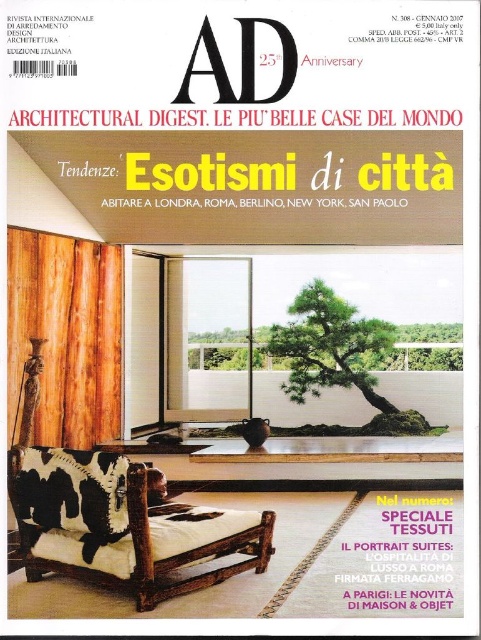
Is green textured bonsai at center thinner than green leafy tree at center?

No.

Who is shorter, green textured bonsai at center or green leafy tree at center?

Standing shorter between the two is green leafy tree at center.

Where is `green textured bonsai at center`? green textured bonsai at center is located at coordinates (330, 346).

The height and width of the screenshot is (640, 481). Identify the location of green textured bonsai at center. (330, 346).